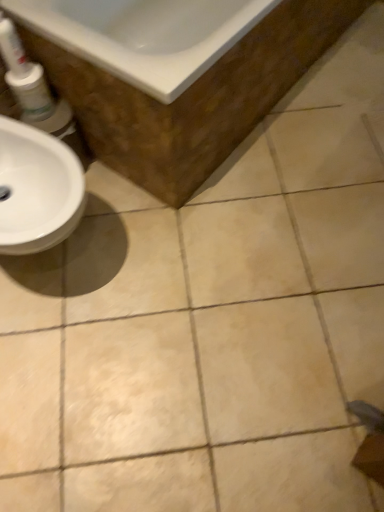
Question: In the image, is white glossy tube at upper left positioned in front of or behind white glossy mouthwash at left?

Choices:
 (A) behind
 (B) front

Answer: (B)

Question: From a real-world perspective, relative to white glossy mouthwash at left, is white glossy tube at upper left vertically above or below?

Choices:
 (A) below
 (B) above

Answer: (B)

Question: Which object is the closest to the white glossy mouthwash at left?

Choices:
 (A) white glossy tube at upper left
 (B) white glossy bathtub at upper left

Answer: (A)

Question: Which is nearer to the white glossy tube at upper left?

Choices:
 (A) white glossy mouthwash at left
 (B) white glossy bathtub at upper left

Answer: (A)